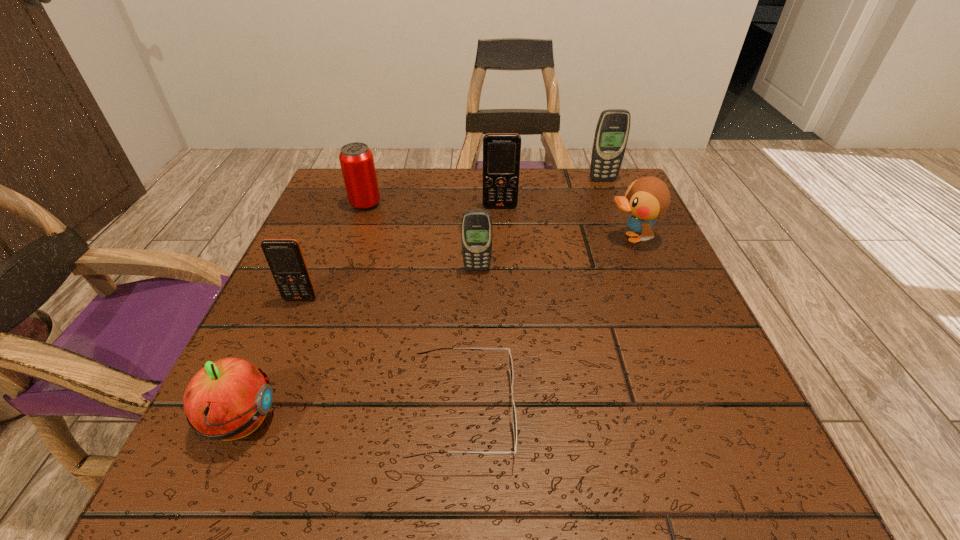
Where is `empty space that is in between the apple and the right gray cellular telephone`? This screenshot has width=960, height=540. empty space that is in between the apple and the right gray cellular telephone is located at coordinates (421, 301).

Identify the location of free space between the left orange cellular telephone and the can. (333, 252).

Where is `free space between the apple and the sunglasses`? This screenshot has height=540, width=960. free space between the apple and the sunglasses is located at coordinates (351, 417).

The image size is (960, 540). I want to click on vacant area that lies between the shortest object and the farther orange cellular telephone, so click(x=481, y=309).

Identify the location of free space between the sunglasses and the right orange cellular telephone. (481, 309).

Where is `vacant space that's between the right gray cellular telephone and the apple`? The width and height of the screenshot is (960, 540). vacant space that's between the right gray cellular telephone and the apple is located at coordinates (421, 301).

Where is `empty location between the shortest object and the can`? The width and height of the screenshot is (960, 540). empty location between the shortest object and the can is located at coordinates (414, 308).

Find the location of `vacant space that's between the farther orange cellular telephone and the bigger gray cellular telephone`. vacant space that's between the farther orange cellular telephone and the bigger gray cellular telephone is located at coordinates (551, 193).

Find the location of `blank region between the blue duck and the can`. blank region between the blue duck and the can is located at coordinates (498, 221).

At what (x,y) coordinates should I click in order to perform the action: click on object that is the sixth closest to the smaller gray cellular telephone. Please return your answer as a coordinate pair (x, y). The width and height of the screenshot is (960, 540). Looking at the image, I should click on (228, 399).